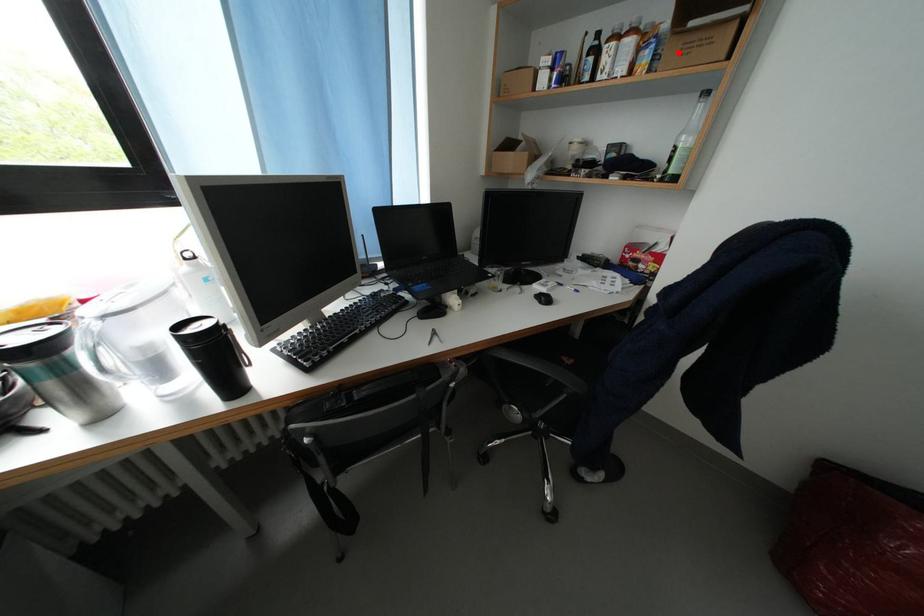
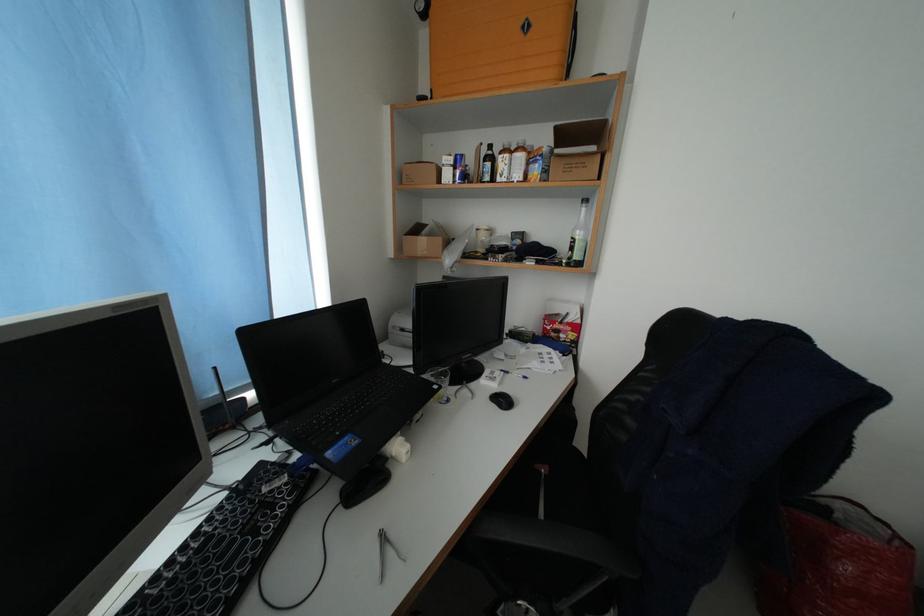
Find the pixel in the second image that matches the highlighted location in the first image.

(563, 169)